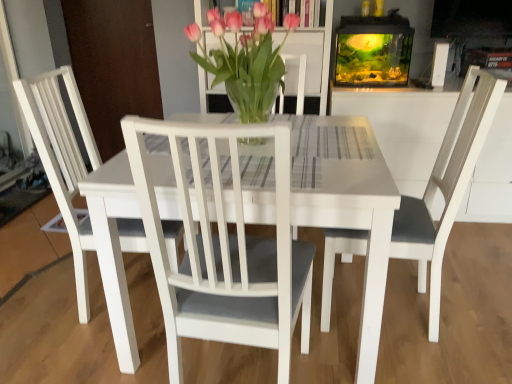
Question: Is white matte chair at center, the 1th chair positioned from the right, at the right side of translucent glass vase at center?

Choices:
 (A) yes
 (B) no

Answer: (A)

Question: Does white matte chair at center, the 2th chair positioned from the left, have a lesser width compared to translucent glass vase at center?

Choices:
 (A) yes
 (B) no

Answer: (B)

Question: Is white matte chair at center, the 2th chair positioned from the left, turned away from translucent glass vase at center?

Choices:
 (A) no
 (B) yes

Answer: (A)

Question: Can we say white matte chair at center, the 2th chair positioned from the left, lies outside translucent glass vase at center?

Choices:
 (A) no
 (B) yes

Answer: (B)

Question: From a real-world perspective, is white matte chair at center, the 2th chair positioned from the left, physically below translucent glass vase at center?

Choices:
 (A) yes
 (B) no

Answer: (A)

Question: Is white matte chair at center, which is the first chair from left to right, wider or thinner than white matte chair at center, the 2th chair positioned from the left?

Choices:
 (A) thin
 (B) wide

Answer: (A)

Question: Considering the positions of white matte chair at center, the 2th chair from the right, and white matte chair at center, the 1th chair positioned from the right, in the image, is white matte chair at center, the 2th chair from the right, taller or shorter than white matte chair at center, the 1th chair positioned from the right,?

Choices:
 (A) short
 (B) tall

Answer: (B)

Question: Is white matte chair at center, the 2th chair from the right, bigger or smaller than white matte chair at center, the 2th chair positioned from the left?

Choices:
 (A) big
 (B) small

Answer: (B)

Question: Does point (77, 236) appear closer or farther from the camera than point (271, 124)?

Choices:
 (A) farther
 (B) closer

Answer: (A)

Question: Is translucent glass vase at center inside the boundaries of white matte chair at center, the 2th chair positioned from the left, or outside?

Choices:
 (A) inside
 (B) outside

Answer: (B)

Question: Based on their positions, is translucent glass vase at center located to the left or right of white matte chair at center, the 1th chair positioned from the right?

Choices:
 (A) left
 (B) right

Answer: (A)

Question: Is translucent glass vase at center wider or thinner than white matte chair at center, the 2th chair positioned from the left?

Choices:
 (A) thin
 (B) wide

Answer: (A)

Question: In terms of size, does translucent glass vase at center appear bigger or smaller than white matte chair at center, the 2th chair positioned from the left?

Choices:
 (A) big
 (B) small

Answer: (B)

Question: Is white matte chair at center, the 1th chair positioned from the right, in front of or behind white matte chair at center, which is the first chair from left to right, in the image?

Choices:
 (A) behind
 (B) front

Answer: (B)

Question: From a real-world perspective, is white matte chair at center, the 1th chair positioned from the right, above or below white matte chair at center, the 2th chair from the right?

Choices:
 (A) above
 (B) below

Answer: (B)